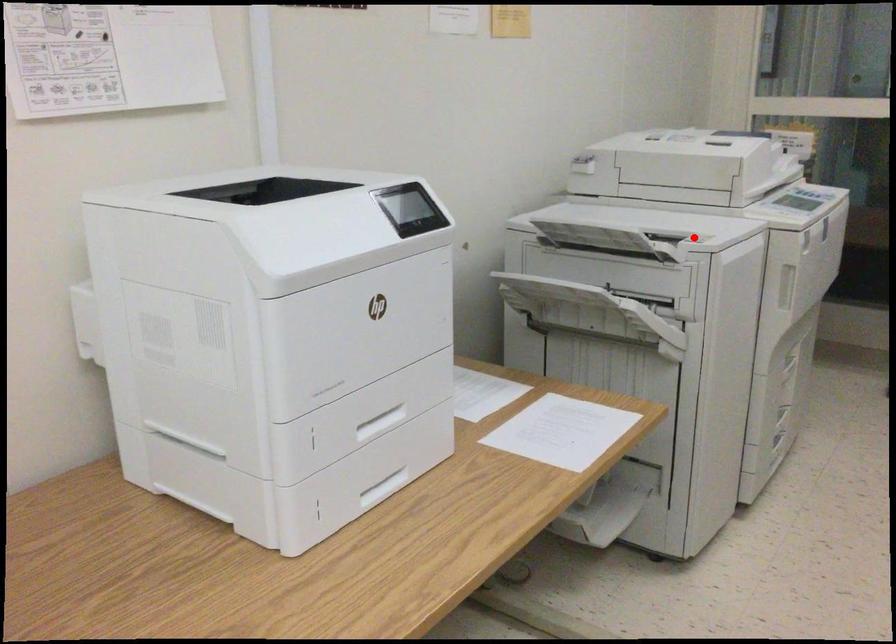
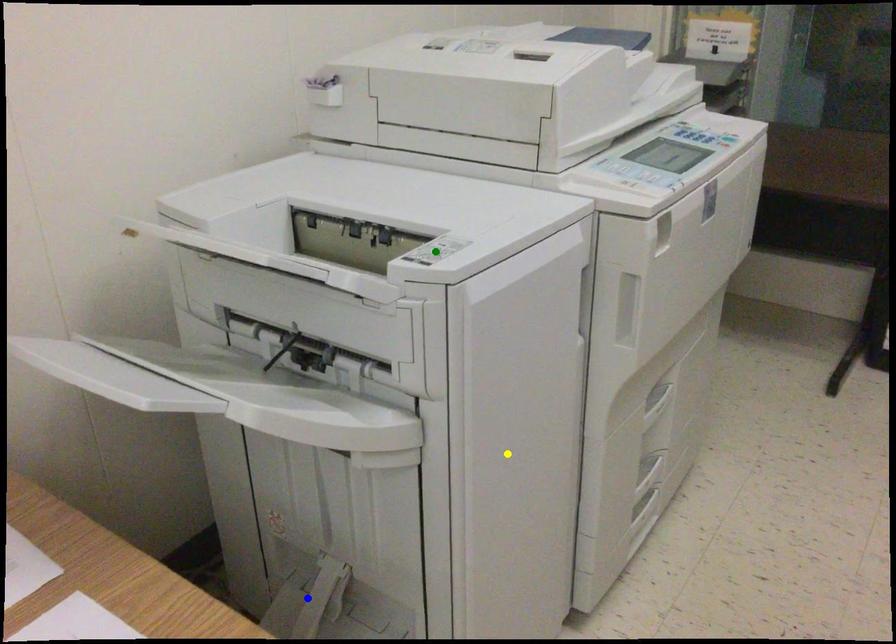
Question: I am providing you with two images of the same scene from different viewpoints. A red point is marked on the first image. You are given multiple points on the second image. Which point in image 2 represents the same 3d spot as the red point in image 1?

Choices:
 (A) blue point
 (B) yellow point
 (C) green point

Answer: (C)